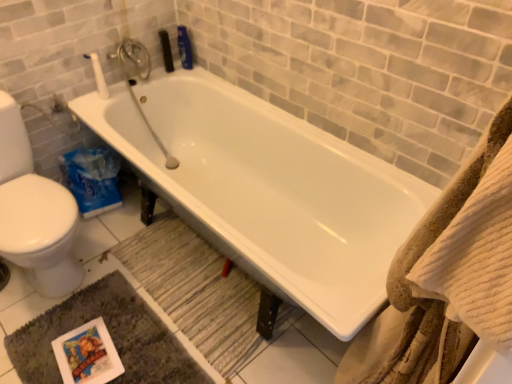
Find the location of a particular element. This screenshot has width=512, height=384. free point to the right of dark gray plush bath mat at lower left, which ranks as the second bath mat in top-to-bottom order is located at coordinates (233, 329).